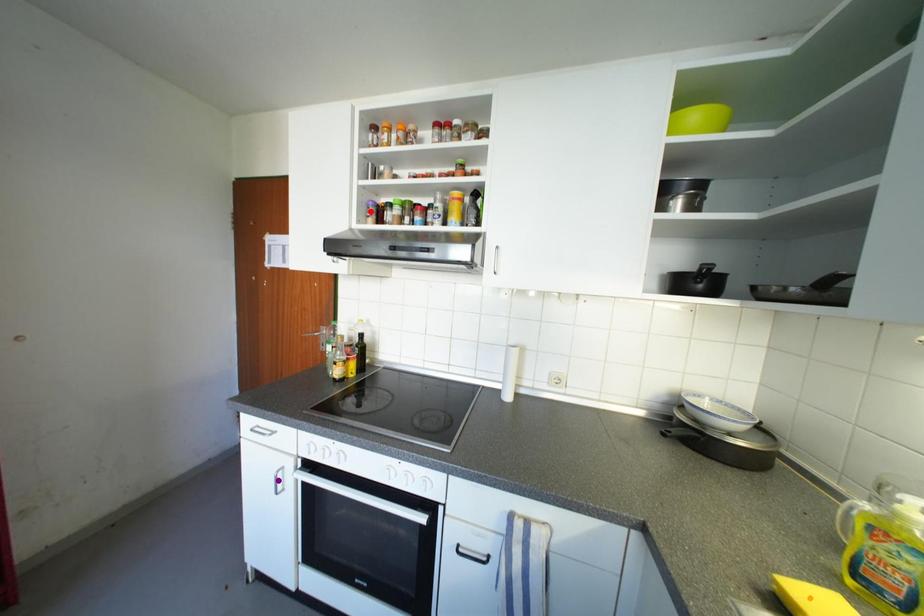
Order these from nearest to farthest:
- purple point
- red point
- orange point

orange point, purple point, red point